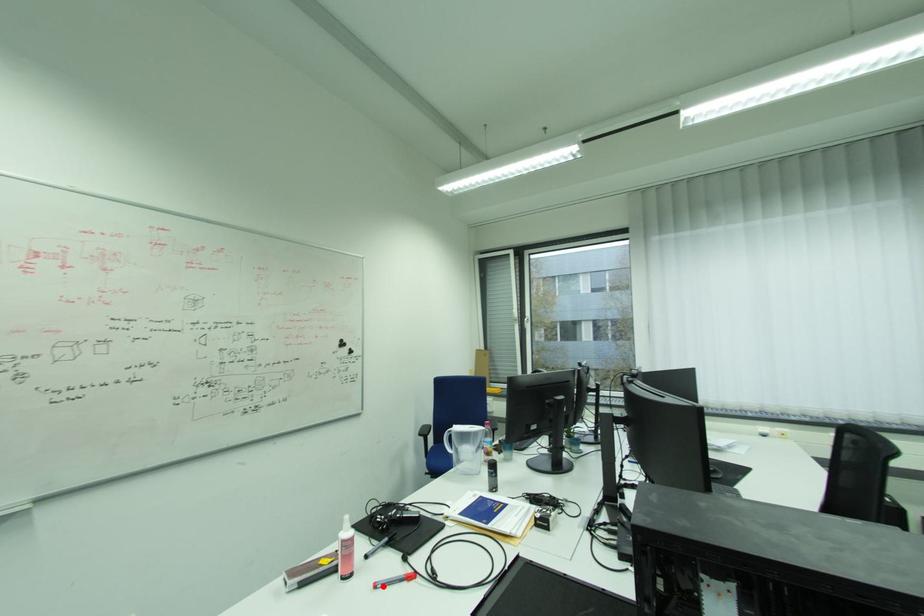
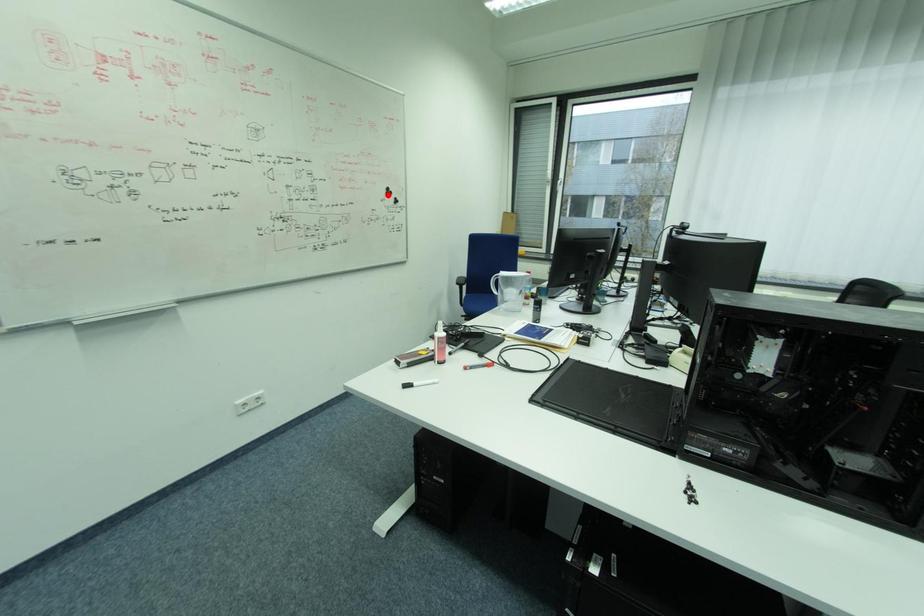
I am providing you with two images of the same scene from different viewpoints. A red point is marked on the first image and another point is marked on the second image. Does the point marked in image1 correspond to the same location as the one in image2?

No